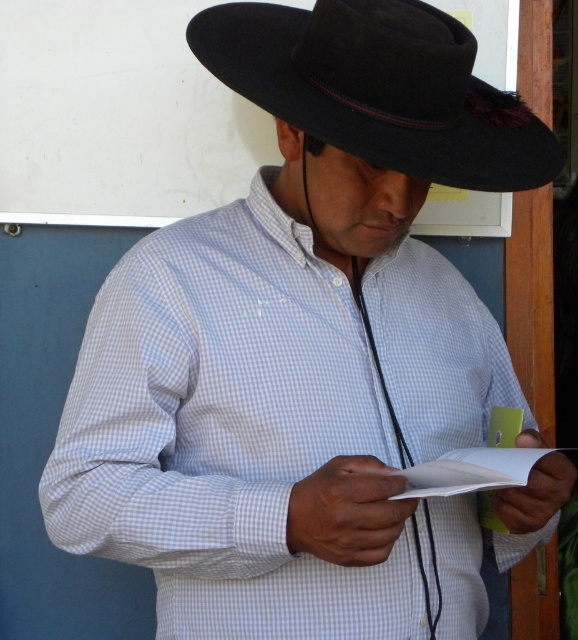
Question: Which of the following is the farthest from the observer?

Choices:
 (A) black felt fedora at upper center
 (B) white paper at center

Answer: (A)

Question: Can you confirm if black felt fedora at upper center is positioned to the left of white paper at center?

Choices:
 (A) no
 (B) yes

Answer: (B)

Question: In this image, where is black felt fedora at upper center located relative to white paper at center?

Choices:
 (A) below
 (B) above

Answer: (B)

Question: Which of the following is the closest to the observer?

Choices:
 (A) white paper at center
 (B) black felt fedora at upper center

Answer: (A)

Question: Which object appears closest to the camera in this image?

Choices:
 (A) black felt fedora at upper center
 (B) white paper at center

Answer: (B)

Question: Is black felt fedora at upper center positioned behind white paper at center?

Choices:
 (A) yes
 (B) no

Answer: (A)